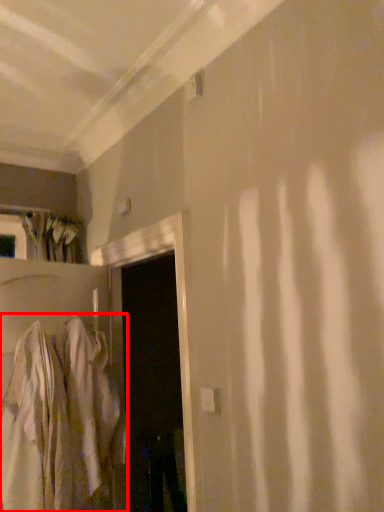
Question: Considering the relative positions of robe (annotated by the red box) and door in the image provided, where is robe (annotated by the red box) located with respect to the staircase?

Choices:
 (A) left
 (B) right

Answer: (A)